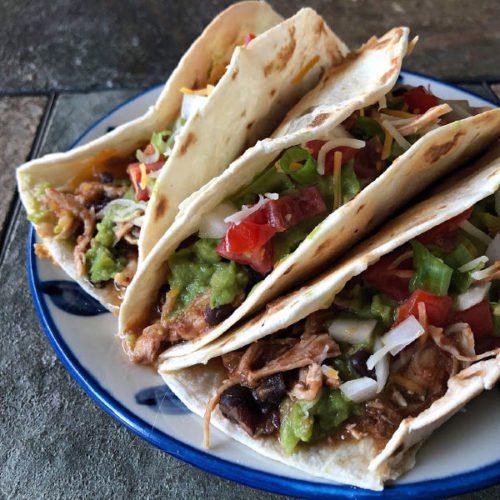
In order to click on brown tile upper right corner in this screenshot , I will do `click(476, 38)`.